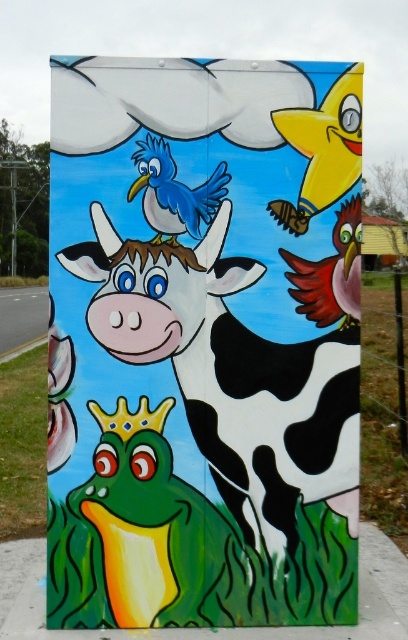
Question: Which object is closer to the camera taking this photo?

Choices:
 (A) shiny blue bird at center
 (B) matte blue bird at upper center
 (C) matte black cow at center
 (D) shiny red bird at center right

Answer: (C)

Question: Considering the real-world distances, which object is closest to the shiny yellow bird at upper right?

Choices:
 (A) matte blue bird at upper center
 (B) matte black cow at center
 (C) shiny red bird at center right

Answer: (C)

Question: Is matte black cow at center wider than shiny red bird at center right?

Choices:
 (A) yes
 (B) no

Answer: (A)

Question: Does shiny yellow bird at upper right have a smaller size compared to shiny red bird at center right?

Choices:
 (A) no
 (B) yes

Answer: (A)

Question: Observing the image, what is the correct spatial positioning of shiny blue bird at center in reference to shiny red bird at center right?

Choices:
 (A) right
 (B) left

Answer: (B)

Question: Which point appears farthest from the camera in this image?

Choices:
 (A) click(337, 90)
 (B) click(197, 170)
 (C) click(170, 240)

Answer: (A)